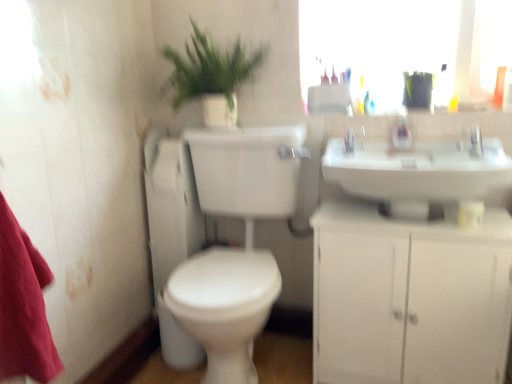
Question: Should I look upward or downward to see green leafy plant at upper center?

Choices:
 (A) down
 (B) up

Answer: (B)

Question: From a real-world perspective, is white glossy toilet at center on top of white glossy toilet at center-left?

Choices:
 (A) no
 (B) yes

Answer: (A)

Question: Is white glossy toilet at center thinner than white glossy toilet at center-left?

Choices:
 (A) yes
 (B) no

Answer: (B)

Question: Is white glossy toilet at center next to white glossy toilet at center-left?

Choices:
 (A) yes
 (B) no

Answer: (B)

Question: From the image's perspective, is white glossy toilet at center under white glossy toilet at center-left?

Choices:
 (A) no
 (B) yes

Answer: (B)

Question: Can you confirm if white glossy toilet at center is bigger than white glossy toilet at center-left?

Choices:
 (A) no
 (B) yes

Answer: (B)

Question: Does white glossy toilet at center have a greater width compared to white glossy toilet at center-left?

Choices:
 (A) no
 (B) yes

Answer: (B)

Question: Does white matte cabinet at lower right have a greater height compared to green leafy plant at upper center?

Choices:
 (A) yes
 (B) no

Answer: (A)

Question: From a real-world perspective, does white matte cabinet at lower right stand above green leafy plant at upper center?

Choices:
 (A) no
 (B) yes

Answer: (A)

Question: Considering the relative sizes of white matte cabinet at lower right and green leafy plant at upper center in the image provided, is white matte cabinet at lower right thinner than green leafy plant at upper center?

Choices:
 (A) yes
 (B) no

Answer: (A)

Question: Are white matte cabinet at lower right and green leafy plant at upper center located far from each other?

Choices:
 (A) yes
 (B) no

Answer: (B)

Question: Is white matte cabinet at lower right surrounding green leafy plant at upper center?

Choices:
 (A) no
 (B) yes

Answer: (A)

Question: Considering the relative sizes of white matte cabinet at lower right and green leafy plant at upper center in the image provided, is white matte cabinet at lower right bigger than green leafy plant at upper center?

Choices:
 (A) yes
 (B) no

Answer: (A)

Question: Could you tell me if satin nickel faucet at upper center is facing white glossy toilet at center-left?

Choices:
 (A) yes
 (B) no

Answer: (B)